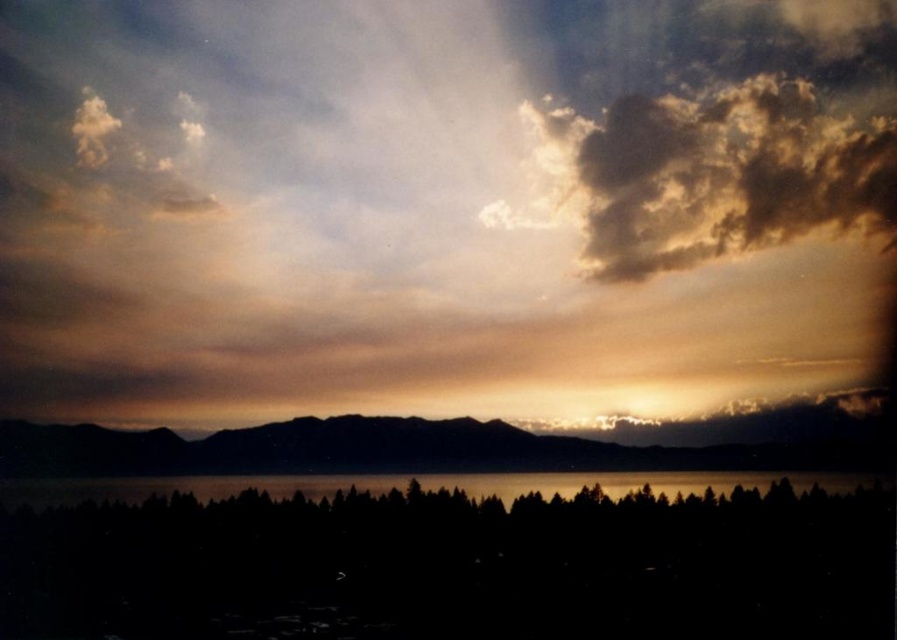
You are standing in the sunset scene and want to place a small flag at both point (524, 13) and point (49, 502). Which point will appear larger in your view?

Point (524, 13) is closer to the camera than point (49, 502), so it will appear larger in your view.

You are standing at the center of the image and want to locate the black matte trees at bottom. In which direction should you look to find them?

You should look downward to find the black matte trees at bottom since they are located at the bottom of the image.

You are an astronomer observing the sunset scene. You notice the golden textured cloud at upper right and the silhouette mountain at center. Which object appears higher in the sky?

The golden textured cloud at upper right appears higher in the sky than the silhouette mountain at center because it is located above it.